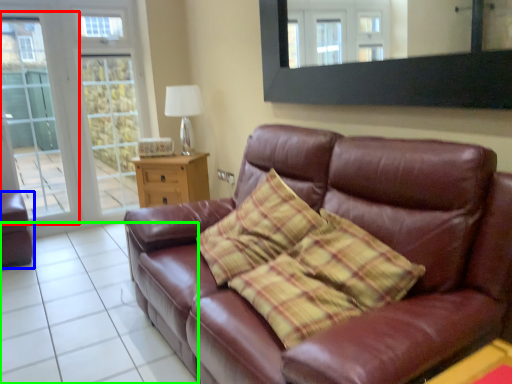
Question: Based on their relative distances, which object is nearer to screen door (highlighted by a red box)? Choose from armchair (highlighted by a blue box) and tile (highlighted by a green box).

Choices:
 (A) armchair
 (B) tile

Answer: (A)